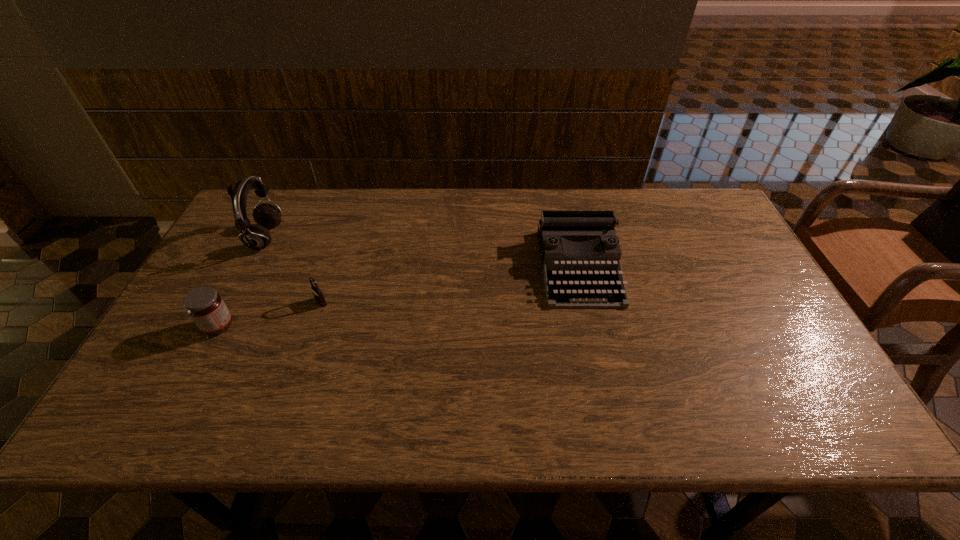
Locate an element on the screen. Image resolution: width=960 pixels, height=540 pixels. the tallest object is located at coordinates (257, 237).

You are a GUI agent. You are given a task and a screenshot of the screen. Output one action in this format:
    pyautogui.click(x=<x>, y=<y>)
    Task: Click on the jam
    
    Given the screenshot: What is the action you would take?
    pyautogui.click(x=205, y=306)

At what (x,y) coordinates should I click in order to perform the action: click on the rightmost object. Please return your answer as a coordinate pair (x, y). Looking at the image, I should click on (571, 281).

Identify the location of the shortest object. (318, 295).

Find the location of a particular element. the second object from right to left is located at coordinates coord(318,295).

At what (x,y) coordinates should I click in order to perform the action: click on free space located 0.240m on the ear pads of the earphone. Please return your answer as a coordinate pair (x, y). Looking at the image, I should click on (357, 238).

I want to click on blank space located on the right of the jam, so click(x=257, y=326).

Identify the location of vacant space situated on the typing side of the rightmost object. (606, 389).

Where is `free spot located on the left of the shortest object`? Image resolution: width=960 pixels, height=540 pixels. free spot located on the left of the shortest object is located at coordinates (296, 302).

Where is `earphone present at the far edge`? The width and height of the screenshot is (960, 540). earphone present at the far edge is located at coordinates (257, 237).